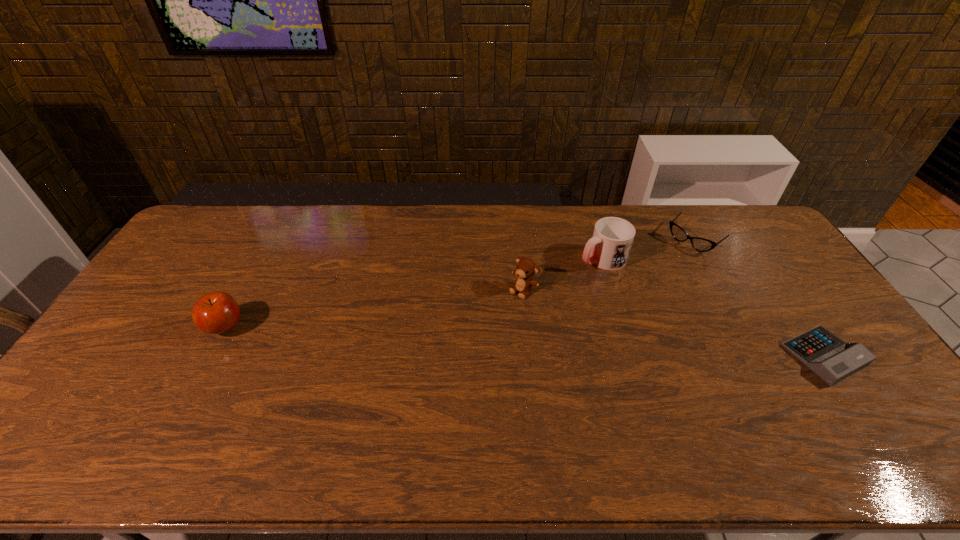
The width and height of the screenshot is (960, 540). What are the coordinates of `free spot between the shortest object and the third nearest object` in the screenshot? It's located at (674, 322).

The width and height of the screenshot is (960, 540). Find the location of `vacant space in between the mug and the calculator`. vacant space in between the mug and the calculator is located at coordinates (713, 307).

Point out which object is positioned as the third nearest to the fourth tallest object. Please provide its 2D coordinates. Your answer should be formatted as a tuple, i.e. [(x, y)], where the tuple contains the x and y coordinates of a point satisfying the conditions above.

[(526, 267)]

The image size is (960, 540). I want to click on object that is the fourth nearest to the spectacles, so click(x=216, y=313).

The image size is (960, 540). Identify the location of vacant area in the image that satisfies the following two spatial constraints: 1. on the back side of the third nearest object; 2. on the left side of the spectacles. (518, 240).

Where is `vacant region that satisfies the following two spatial constraints: 1. on the back side of the third farthest object; 2. on the left side of the spectacles`? vacant region that satisfies the following two spatial constraints: 1. on the back side of the third farthest object; 2. on the left side of the spectacles is located at coordinates (518, 240).